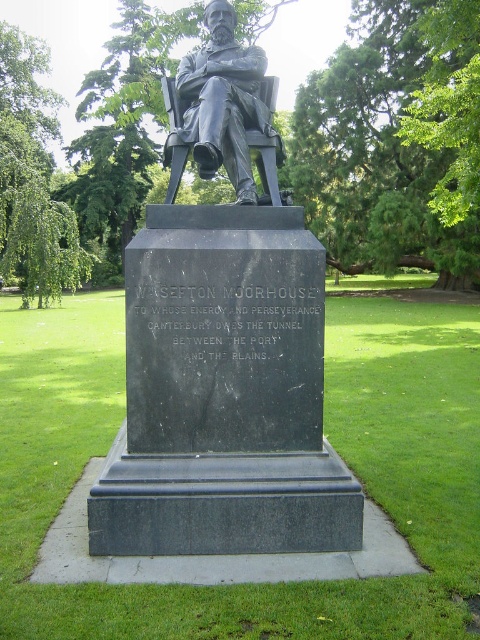
Which is behind, point (181, 467) or point (259, 120)?

Point (259, 120)

Which is more to the left, black marble statue at center or bronze statue at center?

From the viewer's perspective, black marble statue at center appears more on the left side.

Which is behind, point (253, 532) or point (204, 129)?

The point (204, 129) is behind.

Find the location of a particular element. This screenshot has height=640, width=480. black marble statue at center is located at coordinates (224, 346).